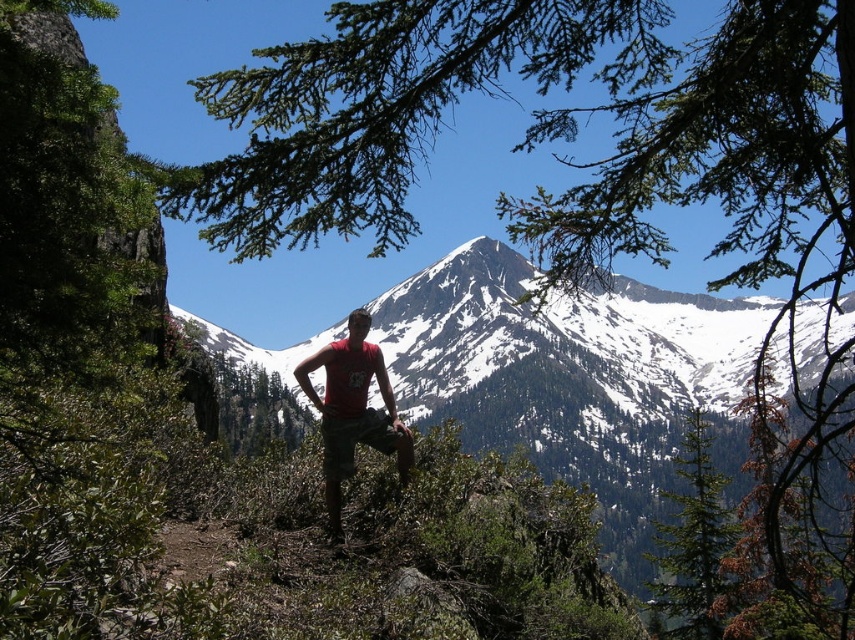
Is snowy granite peak at center below matte red t-shirt at center?

Actually, snowy granite peak at center is above matte red t-shirt at center.

Describe the element at coordinates (562, 336) in the screenshot. The height and width of the screenshot is (640, 855). I see `snowy granite peak at center` at that location.

Where is `snowy granite peak at center`? This screenshot has height=640, width=855. snowy granite peak at center is located at coordinates (562, 336).

Consider the image. Is snowy granite peak at center below green textured tree at center?

Incorrect, snowy granite peak at center is not positioned below green textured tree at center.

Identify the location of snowy granite peak at center. Image resolution: width=855 pixels, height=640 pixels. (562, 336).

Does green textured tree at center have a greater width compared to matte red t-shirt at center?

Yes, green textured tree at center is wider than matte red t-shirt at center.

Is green textured tree at center bigger than matte red t-shirt at center?

Yes, green textured tree at center is bigger than matte red t-shirt at center.

Who is more forward, [694,424] or [342,394]?

Point [342,394]

This screenshot has width=855, height=640. Identify the location of green textured tree at center. (691, 544).